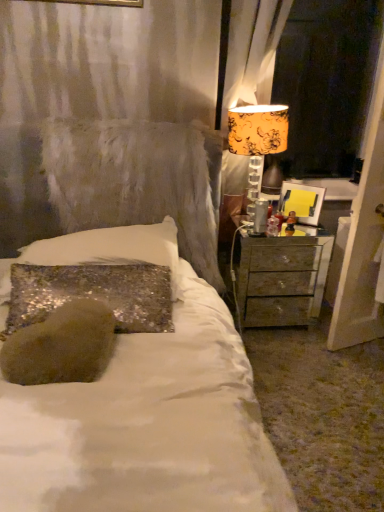
Based on the photo, measure the distance between orange floral fabric at right and camera.

orange floral fabric at right is 8.24 feet from camera.

What do you see at coordinates (281, 277) in the screenshot? I see `metallic silver nightstand at right` at bounding box center [281, 277].

Identify the location of sparkly silver pillow at center. The width and height of the screenshot is (384, 512). (113, 249).

Find the location of `yellow paper at right`. yellow paper at right is located at coordinates (302, 202).

Does point (316, 280) appear closer or farther from the camera than point (254, 136)?

Point (316, 280) is positioned farther from the camera compared to point (254, 136).

Is metallic silver nightstand at right aimed at orange floral fabric lampshade at upper right?

No.

From the image's perspective, between metallic silver nightstand at right and orange floral fabric lampshade at upper right, which one is located above?

orange floral fabric lampshade at upper right appears higher in the image.

Would you say metallic silver nightstand at right is inside or outside orange floral fabric lampshade at upper right?

metallic silver nightstand at right exists outside the volume of orange floral fabric lampshade at upper right.

Can you confirm if sparkly silver pillow at center is thinner than orange floral fabric at right?

Incorrect, the width of sparkly silver pillow at center is not less than that of orange floral fabric at right.

Does sparkly silver pillow at center have a greater height compared to orange floral fabric at right?

Incorrect, the height of sparkly silver pillow at center is not larger of that of orange floral fabric at right.

Could orange floral fabric at right be considered to be inside sparkly silver pillow at center?

Definitely not — orange floral fabric at right is not inside sparkly silver pillow at center.

Is the position of sparkly silver pillow at center less distant than that of orange floral fabric at right?

Yes, sparkly silver pillow at center is closer to the camera.

Consider the image. Can you confirm if metallic silver nightstand at right is thinner than orange floral fabric at right?

No.

Is metallic silver nightstand at right inside or outside of orange floral fabric at right?

The correct answer is: outside.

From a real-world perspective, is metallic silver nightstand at right below orange floral fabric at right?

Yes, from a real-world perspective, metallic silver nightstand at right is under orange floral fabric at right.

Can you confirm if metallic silver nightstand at right is bigger than orange floral fabric at right?

Incorrect, metallic silver nightstand at right is not larger than orange floral fabric at right.

From a real-world perspective, is orange floral fabric lampshade at upper right positioned over orange floral fabric at right based on gravity?

No, from a real-world perspective, orange floral fabric lampshade at upper right is not above orange floral fabric at right.

Considering the relative sizes of orange floral fabric lampshade at upper right and orange floral fabric at right in the image provided, is orange floral fabric lampshade at upper right thinner than orange floral fabric at right?

Incorrect, the width of orange floral fabric lampshade at upper right is not less than that of orange floral fabric at right.

Does orange floral fabric lampshade at upper right have a smaller size compared to orange floral fabric at right?

Indeed, orange floral fabric lampshade at upper right has a smaller size compared to orange floral fabric at right.

Does orange floral fabric lampshade at upper right appear on the left side of orange floral fabric at right?

Yes, orange floral fabric lampshade at upper right is to the left of orange floral fabric at right.

Which of these two, orange floral fabric lampshade at upper right or sparkly silver pillow at center, is bigger?

sparkly silver pillow at center is bigger.

From the picture: Which object is further away from the camera, orange floral fabric lampshade at upper right or sparkly silver pillow at center?

orange floral fabric lampshade at upper right is further away from the camera.

Considering the relative sizes of orange floral fabric lampshade at upper right and sparkly silver pillow at center in the image provided, is orange floral fabric lampshade at upper right shorter than sparkly silver pillow at center?

Incorrect, the height of orange floral fabric lampshade at upper right does not fall short of that of sparkly silver pillow at center.

Consider the image. From a real-world perspective, which object stands above the other?

In real-world perspective, orange floral fabric lampshade at upper right is above.

Considering the relative sizes of sparkly silver pillow at center and metallic silver nightstand at right in the image provided, is sparkly silver pillow at center bigger than metallic silver nightstand at right?

No, sparkly silver pillow at center is not bigger than metallic silver nightstand at right.

Would you say sparkly silver pillow at center is a long distance from metallic silver nightstand at right?

No, sparkly silver pillow at center is not far away from metallic silver nightstand at right.

Is sparkly silver pillow at center facing away from metallic silver nightstand at right?

sparkly silver pillow at center does not have its back to metallic silver nightstand at right.

In the scene shown: Can you confirm if sparkly silver pillow at center is taller than metallic silver nightstand at right?

Incorrect, the height of sparkly silver pillow at center is not larger of that of metallic silver nightstand at right.

Measure the distance between orange floral fabric at right and metallic silver nightstand at right.

orange floral fabric at right is 4.34 feet away from metallic silver nightstand at right.

From the image's perspective, is orange floral fabric at right positioned above or below metallic silver nightstand at right?

Clearly, from the image's perspective, orange floral fabric at right is above metallic silver nightstand at right.

Identify the location of window screen on the right of metallic silver nightstand at right. This screenshot has width=384, height=512. (326, 83).

Between orange floral fabric at right and metallic silver nightstand at right, which one has larger size?

orange floral fabric at right is bigger.

Locate an element on the screen. The image size is (384, 512). nightstand on the right of orange floral fabric lampshade at upper right is located at coordinates (281, 277).

You are a GUI agent. You are given a task and a screenshot of the screen. Output one action in this format:
    pyautogui.click(x=<x>, y=<y>)
    Task: Click on the pillow below the orange floral fabric at right (from the image's perspective)
    
    Given the screenshot: What is the action you would take?
    pyautogui.click(x=113, y=249)

From the image, which object appears to be nearer to metallic silver nightstand at right, sparkly silver pillow at center or orange floral fabric at right?

sparkly silver pillow at center lies closer to metallic silver nightstand at right than the other object.

When comparing their distances from sparkly silver pillow at center, does metallic silver nightstand at right or orange floral fabric lampshade at upper right seem closer?

The object closer to sparkly silver pillow at center is orange floral fabric lampshade at upper right.

Based on their spatial positions, is orange floral fabric lampshade at upper right or sparkly silver pillow at center further from metallic silver nightstand at right?

sparkly silver pillow at center.

Based on the photo, which object lies nearer to the anchor point sparkly silver pillow at center, yellow paper at right or metallic silver nightstand at right?

metallic silver nightstand at right is closer to sparkly silver pillow at center.

Based on their spatial positions, is sparkly silver pillow at center or metallic silver nightstand at right further from orange floral fabric at right?

The object further to orange floral fabric at right is sparkly silver pillow at center.

When comparing their distances from sparkly silver pillow at center, does metallic silver nightstand at right or orange floral fabric at right seem further?

orange floral fabric at right.

Estimate the real-world distances between objects in this image. Which object is further from metallic silver nightstand at right, yellow paper at right or sparkly silver pillow at center?

sparkly silver pillow at center is further to metallic silver nightstand at right.

Looking at the image, which one is located further to sparkly silver pillow at center, orange floral fabric lampshade at upper right or yellow paper at right?

yellow paper at right.

Find the location of `nightstand between sparkly silver pillow at center and orange floral fabric at right`. nightstand between sparkly silver pillow at center and orange floral fabric at right is located at coordinates (281, 277).

You are a GUI agent. You are given a task and a screenshot of the screen. Output one action in this format:
    pyautogui.click(x=<x>, y=<y>)
    Task: Click on the table lamp between sparkly silver pillow at center and yellow paper at right
    This screenshot has height=512, width=384.
    Given the screenshot: What is the action you would take?
    pyautogui.click(x=258, y=129)

The height and width of the screenshot is (512, 384). I want to click on table lamp between orange floral fabric at right and yellow paper at right vertically, so click(x=258, y=129).

In order to click on picture frame that lies between orange floral fabric at right and metallic silver nightstand at right from top to bottom in this screenshot , I will do `click(302, 202)`.